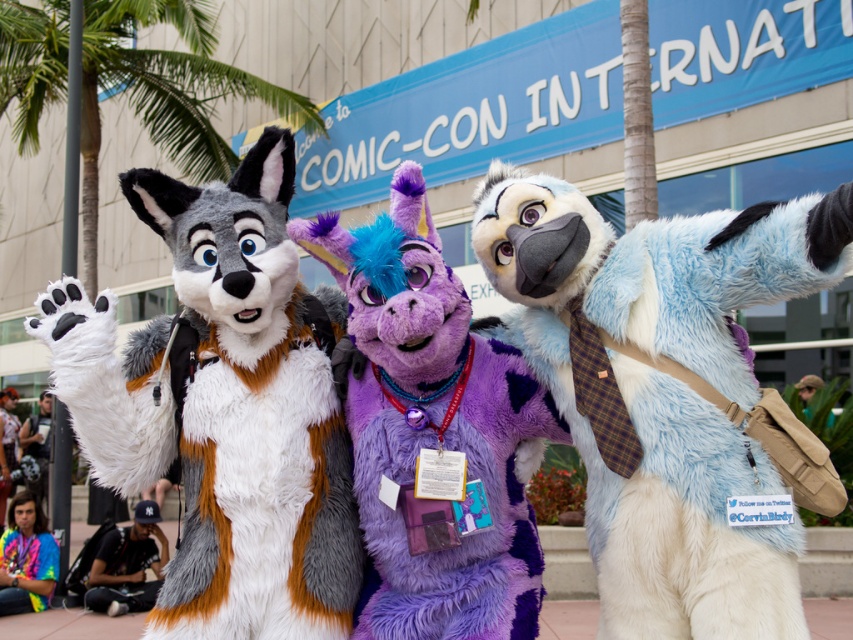
Question: Which object is farther from the camera taking this photo?

Choices:
 (A) light blue plush fur at center
 (B) black cotton t-shirt at lower left

Answer: (B)

Question: Considering the real-world distances, which object is closest to the black cotton t-shirt at lower left?

Choices:
 (A) tie-dye fabric shirt at lower left
 (B) matte black backpack at left
 (C) purple plush at center
 (D) light blue plush fur at center

Answer: (A)

Question: Considering the relative positions of purple plush at center and tie-dye fabric shirt at lower left in the image provided, where is purple plush at center located with respect to tie-dye fabric shirt at lower left?

Choices:
 (A) right
 (B) left

Answer: (A)

Question: Is purple plush at center closer to the viewer compared to black cotton t-shirt at lower left?

Choices:
 (A) yes
 (B) no

Answer: (A)

Question: Which point appears closest to the camera in this image?

Choices:
 (A) (50, 442)
 (B) (4, 456)

Answer: (B)

Question: Does white fur wolf at left have a greater width compared to black cotton t-shirt at lower left?

Choices:
 (A) no
 (B) yes

Answer: (B)